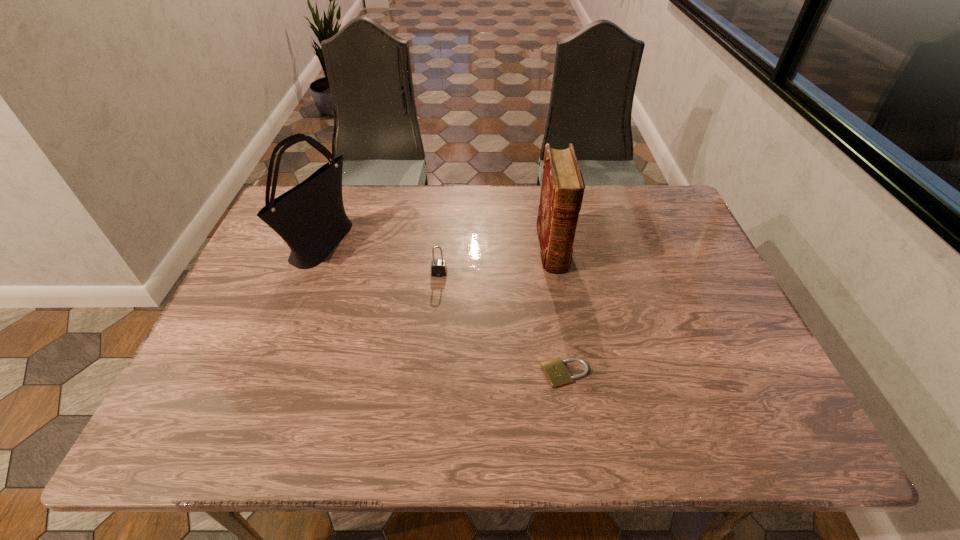
Where is `vacant space located on the left of the nearest object`? vacant space located on the left of the nearest object is located at coordinates (454, 374).

Image resolution: width=960 pixels, height=540 pixels. Identify the location of shoulder bag at the far edge. (310, 217).

The image size is (960, 540). Find the location of `hardback book located at the far edge`. hardback book located at the far edge is located at coordinates (562, 189).

Find the location of a particular element. The height and width of the screenshot is (540, 960). object present at the left edge is located at coordinates (310, 217).

Locate an element on the screen. Image resolution: width=960 pixels, height=540 pixels. object that is at the far left corner is located at coordinates (310, 217).

In order to click on vacant space at the far edge of the desktop in this screenshot , I will do `click(419, 204)`.

Identify the location of vacant position at the near edge of the desktop. (543, 448).

I want to click on free space at the left edge of the desktop, so click(258, 336).

Where is `vacant space at the right edge`? This screenshot has width=960, height=540. vacant space at the right edge is located at coordinates coord(714,283).

This screenshot has height=540, width=960. Identify the location of free area in between the hardback book and the second shortest object. (495, 261).